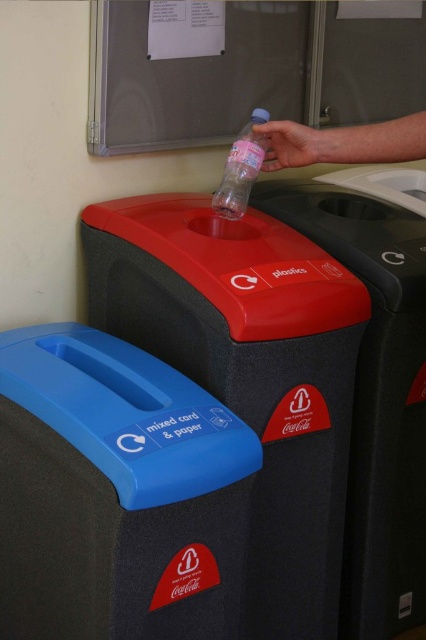
Is blue plastic mixed card & paper at upper left above clear plastic bottle at upper center?

Incorrect, blue plastic mixed card & paper at upper left is not positioned above clear plastic bottle at upper center.

How much distance is there between blue plastic mixed card & paper at upper left and clear plastic bottle at upper center?

26.51 inches

Does point (66, 602) lie behind point (264, 109)?

No, it is not.

At what (x,y) coordinates should I click in order to perform the action: click on blue plastic mixed card & paper at upper left. Please return your answer as a coordinate pair (x, y). Looking at the image, I should click on (115, 493).

Is pink matte plastic bottle at upper center thinner than clear plastic bottle at upper center?

In fact, pink matte plastic bottle at upper center might be wider than clear plastic bottle at upper center.

Is point (408, 115) positioned after point (233, 193)?

Yes, point (408, 115) is farther from viewer.

The width and height of the screenshot is (426, 640). Describe the element at coordinates (342, 141) in the screenshot. I see `pink matte plastic bottle at upper center` at that location.

Image resolution: width=426 pixels, height=640 pixels. I want to click on pink matte plastic bottle at upper center, so click(x=342, y=141).

What do you see at coordinates (115, 493) in the screenshot? The height and width of the screenshot is (640, 426). I see `blue plastic mixed card & paper at upper left` at bounding box center [115, 493].

Can you confirm if blue plastic mixed card & paper at upper left is thinner than red plastic recycling bin at upper center?

Correct, blue plastic mixed card & paper at upper left's width is less than red plastic recycling bin at upper center's.

The image size is (426, 640). I want to click on blue plastic mixed card & paper at upper left, so click(x=115, y=493).